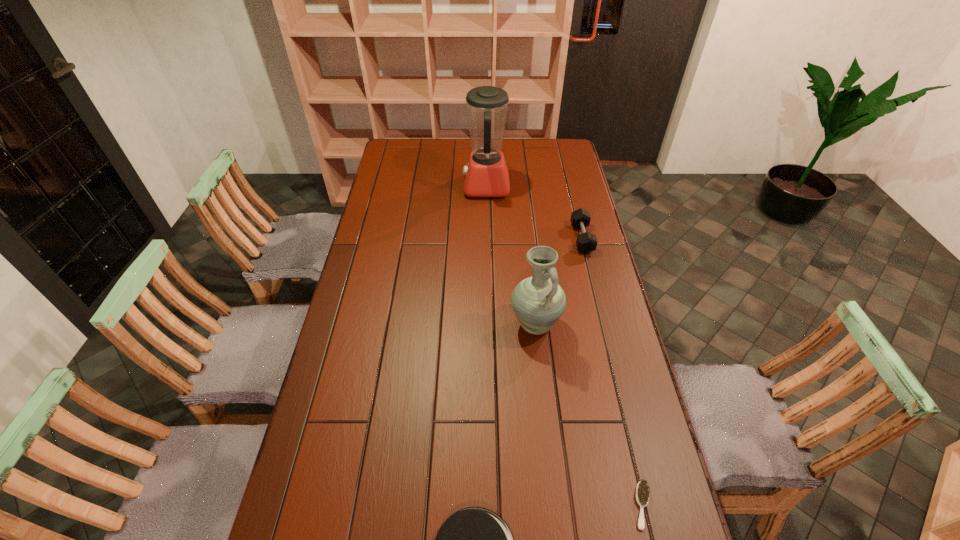
Identify the location of the tallest object. This screenshot has width=960, height=540. (486, 175).

Where is `the farthest object`? the farthest object is located at coordinates (486, 175).

The image size is (960, 540). In order to click on pitcher in this screenshot , I will do `click(539, 301)`.

The width and height of the screenshot is (960, 540). Find the location of `the fourth shortest object`. the fourth shortest object is located at coordinates (539, 301).

Where is `dumbbell`? The width and height of the screenshot is (960, 540). dumbbell is located at coordinates (586, 242).

Image resolution: width=960 pixels, height=540 pixels. I want to click on the fourth nearest object, so click(x=586, y=242).

I want to click on scrubbing brush, so click(x=642, y=490).

I want to click on blank area located 0.160m on the front of the blender near the controls, so click(x=427, y=187).

At what (x,y) coordinates should I click in order to perform the action: click on free location located 0.190m on the front of the blender near the controls. Please return your answer as a coordinate pair (x, y). This screenshot has width=960, height=540. Looking at the image, I should click on (420, 187).

Find the location of `vacant space located on the front of the blender near the controls`. vacant space located on the front of the blender near the controls is located at coordinates (452, 187).